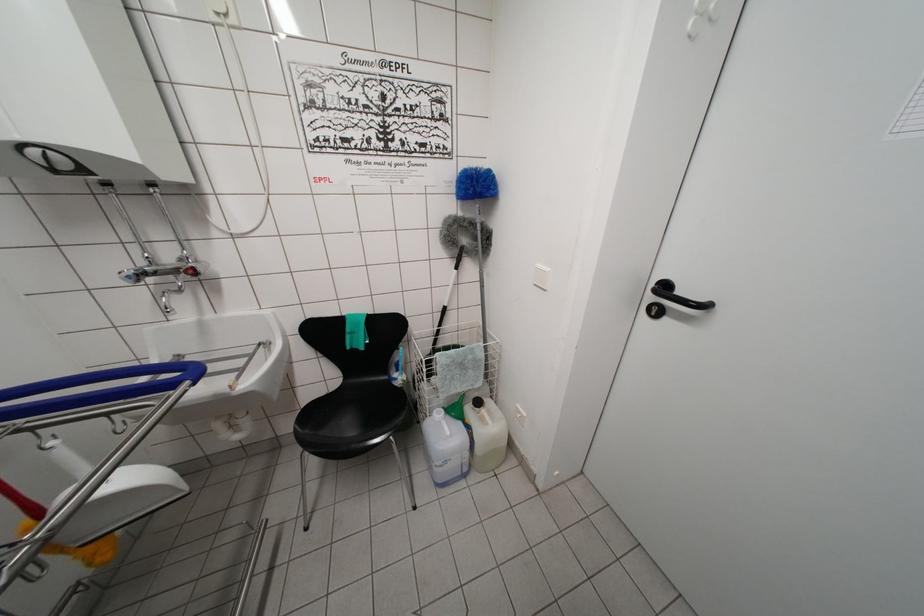
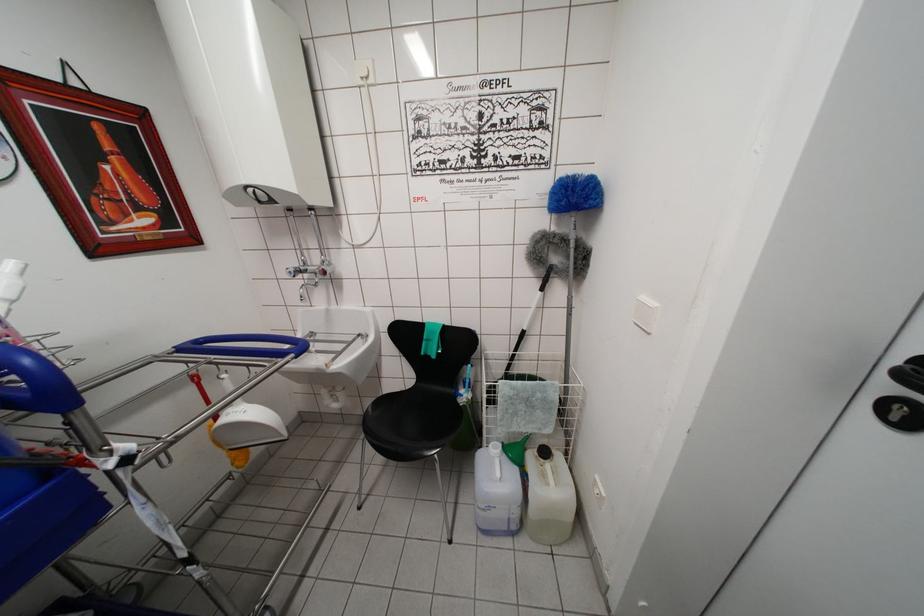
In the second image, find the point that corresponds to point 131,282 in the first image.

(293, 277)